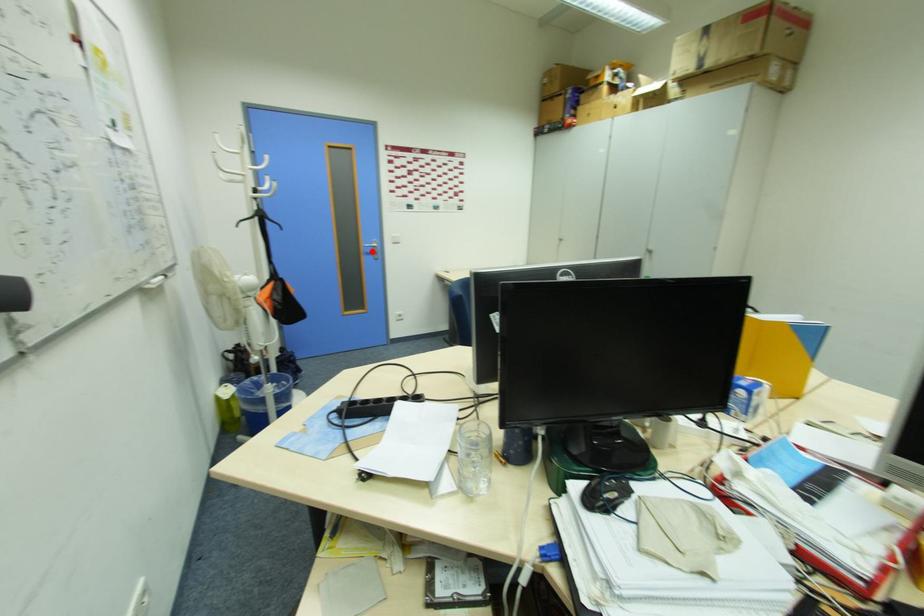
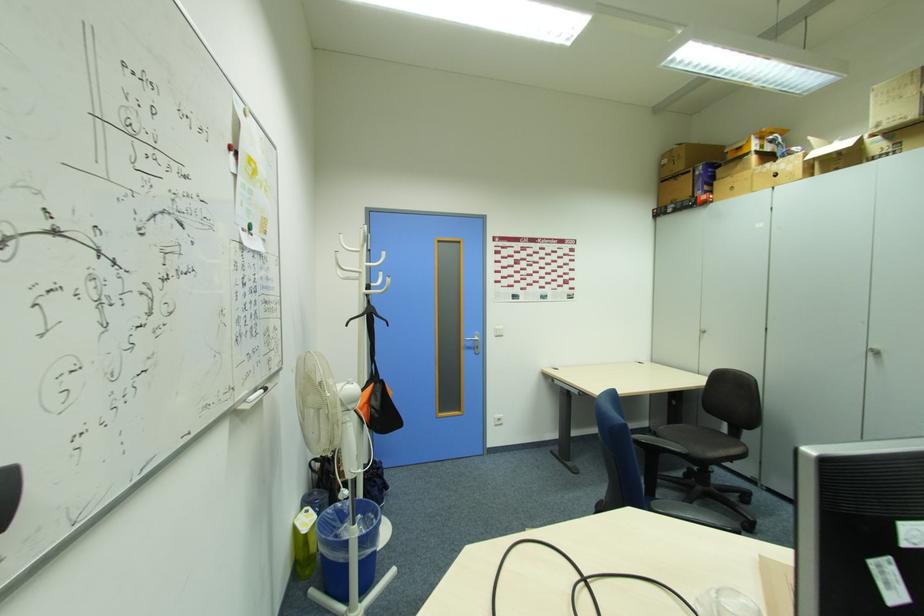
Question: I am providing you with two images of the same scene from different viewpoints. In image1, a red point is highlighted. Considering the same 3D point in image2, which of the following is correct?

Choices:
 (A) It is closer
 (B) It is farther

Answer: (B)